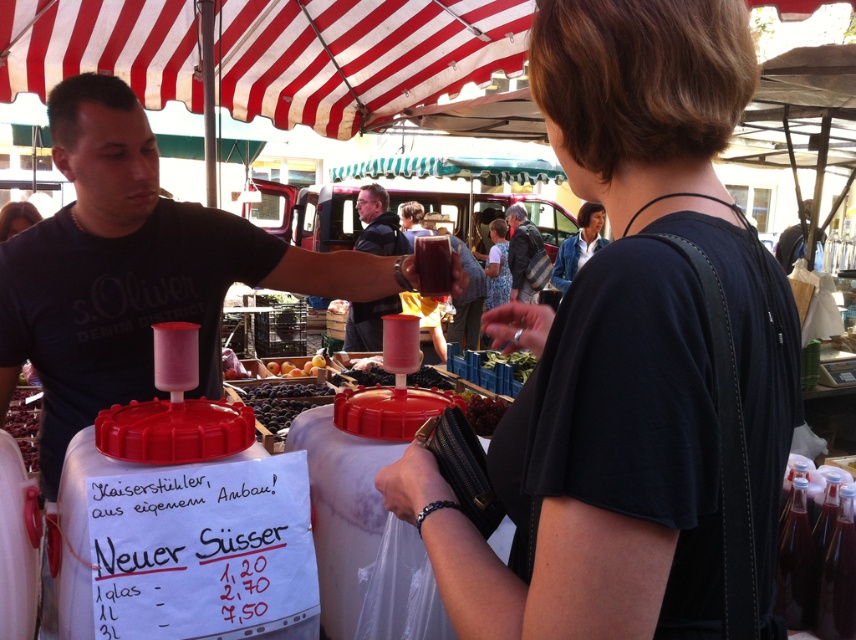
Is matte black shirt at upper left taller than smooth yellow peaches at center?

Indeed, matte black shirt at upper left has a greater height compared to smooth yellow peaches at center.

Is point (33, 218) less distant than point (322, 362)?

No, it is behind (322, 362).

The width and height of the screenshot is (856, 640). In order to click on matte black shirt at upper left in this screenshot , I will do `click(16, 218)`.

Between point (526, 289) and point (443, 385), which one is positioned in front?

Positioned in front is point (443, 385).

Between striped fabric shirt at center and dark purple grapes at center, which one is positioned lower?

dark purple grapes at center is lower down.

Who is more distant from viewer, [541,282] or [343,372]?

Point [541,282]

This screenshot has width=856, height=640. Identify the location of striped fabric shirt at center. (525, 257).

Is striped fabric shirt at center below matte black shirt at upper left?

No.

Locate an element on the screen. The width and height of the screenshot is (856, 640). striped fabric shirt at center is located at coordinates (525, 257).